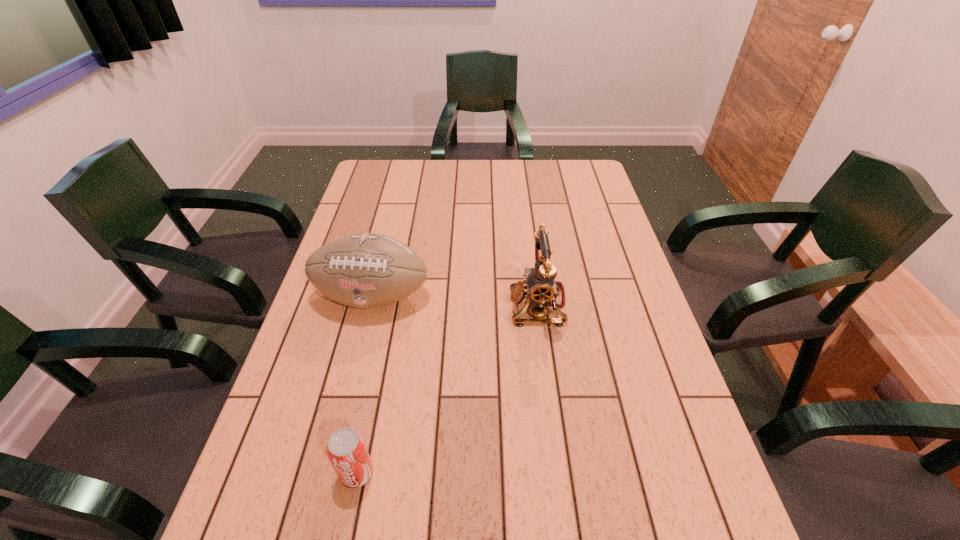
This screenshot has height=540, width=960. Find the location of `the rightmost object`. the rightmost object is located at coordinates (540, 286).

This screenshot has height=540, width=960. Identify the location of the tallest object. (540, 286).

You are a GUI agent. You are given a task and a screenshot of the screen. Output one action in this format:
    pyautogui.click(x=<x>, y=<y>)
    Task: Click on the football (American)
    The width and height of the screenshot is (960, 540).
    Given the screenshot: What is the action you would take?
    pyautogui.click(x=363, y=270)

Image resolution: width=960 pixels, height=540 pixels. I want to click on the nearest object, so click(346, 449).

This screenshot has height=540, width=960. Identify the location of soda can. (346, 449).

Where is `vacant area located on the front of the telephone, featuring the rotary dial`? This screenshot has height=540, width=960. vacant area located on the front of the telephone, featuring the rotary dial is located at coordinates (391, 306).

Locate an element on the screen. This screenshot has width=960, height=540. free location located 0.350m on the front of the telephone, featuring the rotary dial is located at coordinates (379, 306).

The image size is (960, 540). What are the coordinates of `vacant region located 0.330m on the front of the telephone, featuring the rotary dial` in the screenshot? It's located at pyautogui.click(x=387, y=306).

Where is `vacant position located 0.050m on the laces of the second shortest object`? vacant position located 0.050m on the laces of the second shortest object is located at coordinates (362, 339).

This screenshot has width=960, height=540. In order to click on vacant point located on the logo side of the shortest object in this screenshot , I will do `click(346, 525)`.